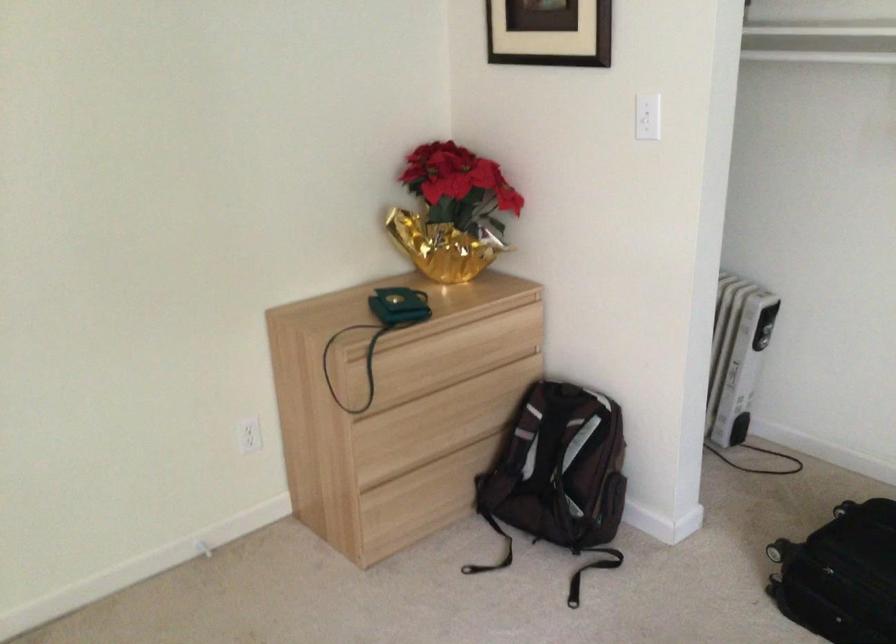
Which object does [558,468] point to?

This point indicates the brown backpack.